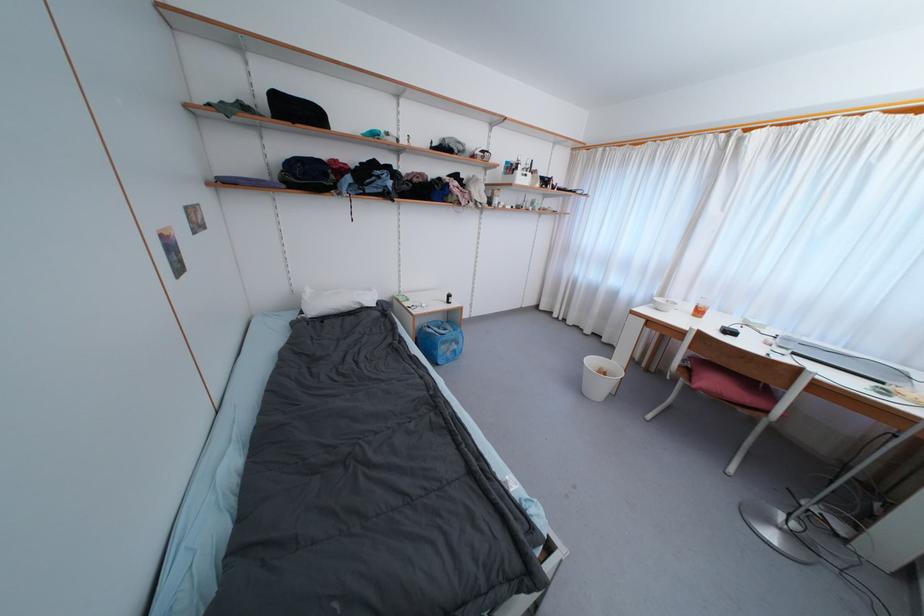
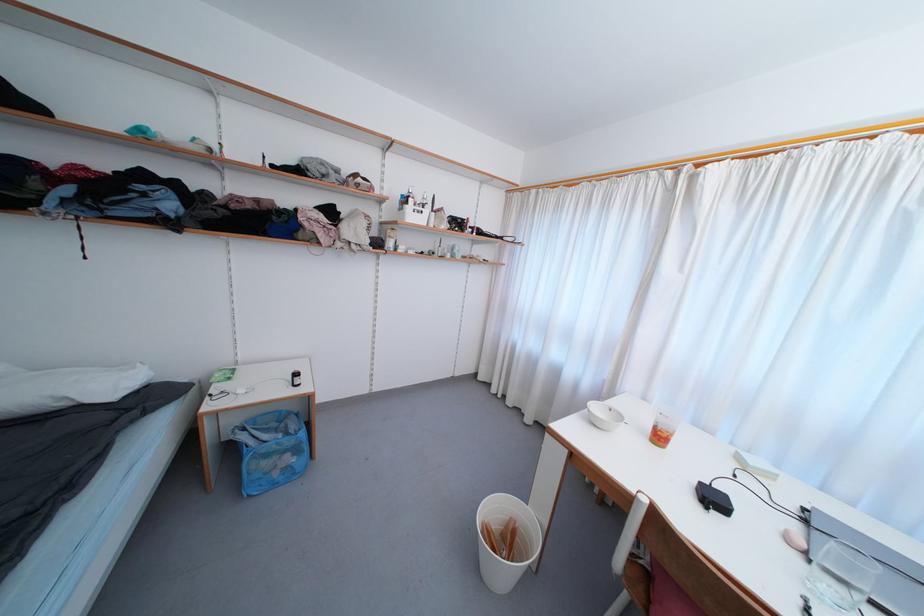
Which direction would the cameraman need to move to produce the second image?

The movement direction of the cameraman is right, forward.